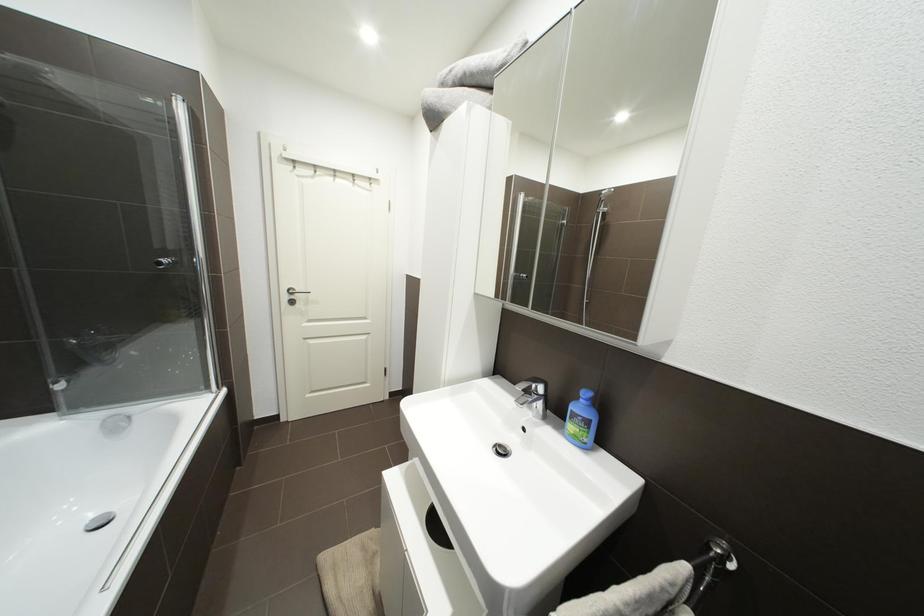
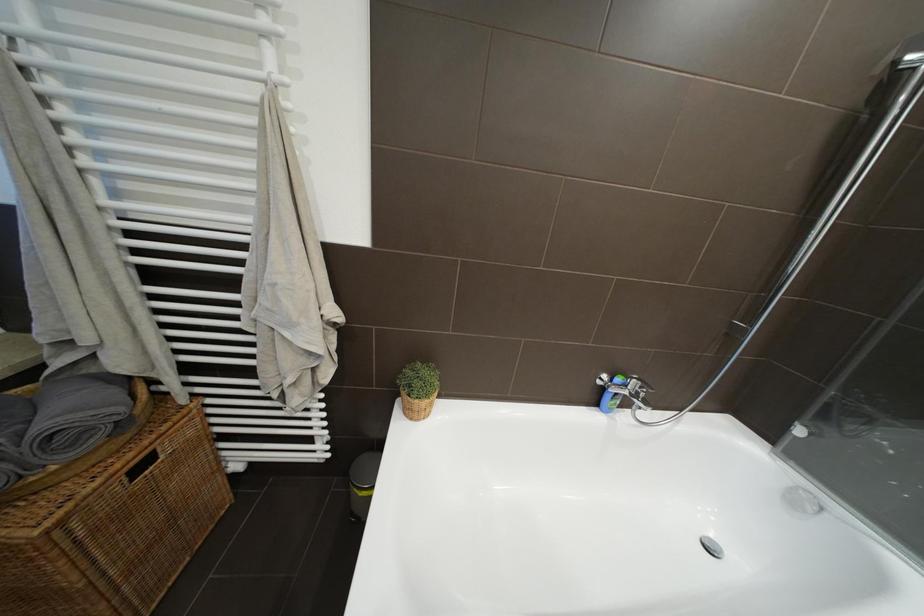
Based on the continuous images, in which direction is the camera rotating?

The rotation direction of the camera is left-down.